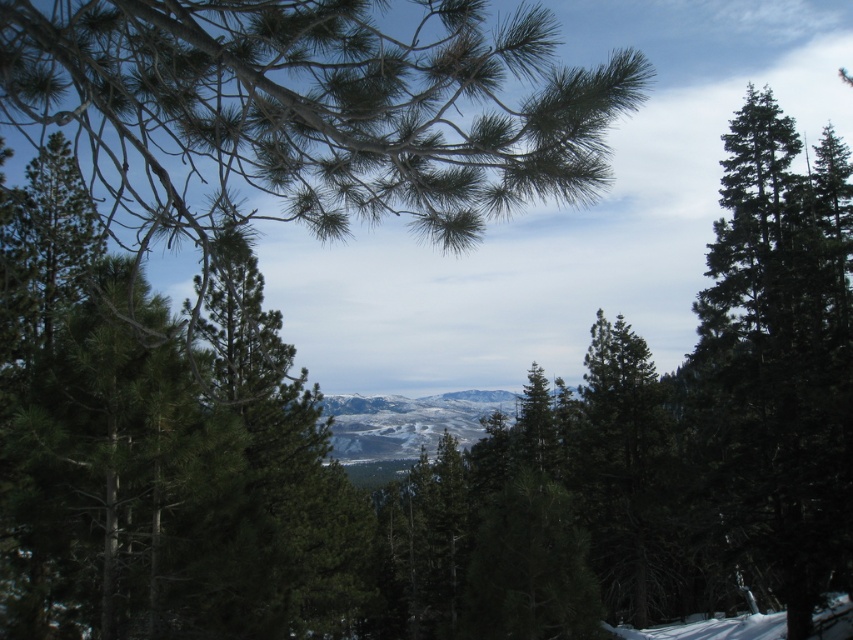
Between green needle-like branches at upper left and green matte tree at right, which one is positioned higher?

green needle-like branches at upper left is higher up.

Does green needle-like branches at upper left have a lesser width compared to green matte tree at right?

No.

Is point (548, 168) more distant than point (821, 289)?

No, it is not.

Where is `green needle-like branches at upper left`? Image resolution: width=853 pixels, height=640 pixels. green needle-like branches at upper left is located at coordinates (310, 112).